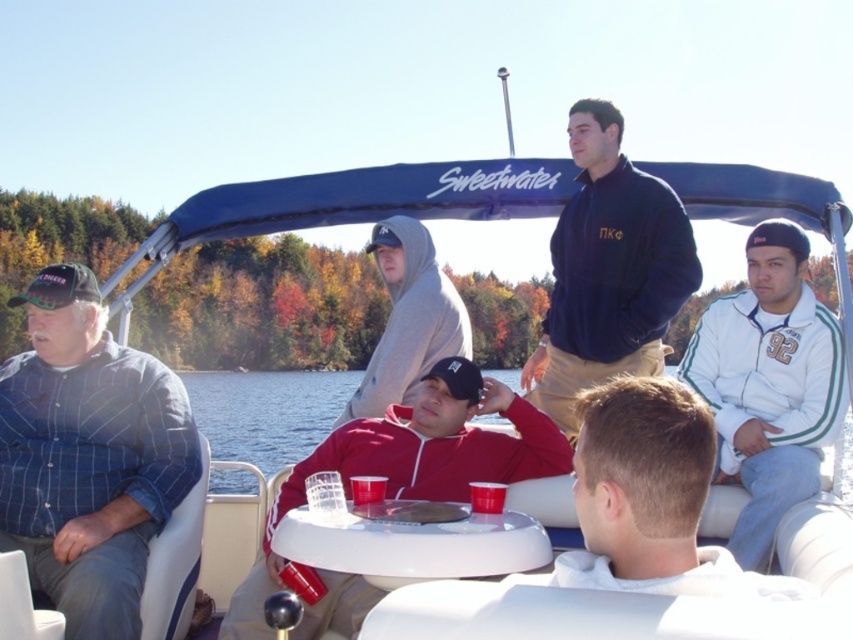
Between point (776, 307) and point (596, 541), which one is positioned behind?

The point (776, 307) is behind.

Can you confirm if white fleece jacket at right is bigger than white fleece jacket at center?

Yes, white fleece jacket at right is bigger than white fleece jacket at center.

Identify the location of white fleece jacket at right. (769, 385).

Can you confirm if navy blue fleece at center is shorter than gray hoodie at center?

No.

Who is lower down, navy blue fleece at center or gray hoodie at center?

gray hoodie at center is lower down.

Between point (612, 294) and point (408, 236), which one is positioned behind?

The point (408, 236) is behind.

You are a GUI agent. You are given a task and a screenshot of the screen. Output one action in this format:
    pyautogui.click(x=<x>, y=<y>)
    Task: Click on the navy blue fleece at center
    
    Given the screenshot: What is the action you would take?
    pyautogui.click(x=608, y=269)

Who is more distant from viewer, [575,228] or [494,380]?

The point [575,228] is behind.

Can you confirm if navy blue fleece at center is positioned below red fleece jacket at center?

Incorrect, navy blue fleece at center is not positioned below red fleece jacket at center.

Who is more distant from viewer, (668, 266) or (450, 371)?

Point (668, 266)

You are a GUI agent. You are given a task and a screenshot of the screen. Output one action in this format:
    pyautogui.click(x=<x>, y=<y>)
    Task: Click on the navy blue fleece at center
    
    Given the screenshot: What is the action you would take?
    pyautogui.click(x=608, y=269)